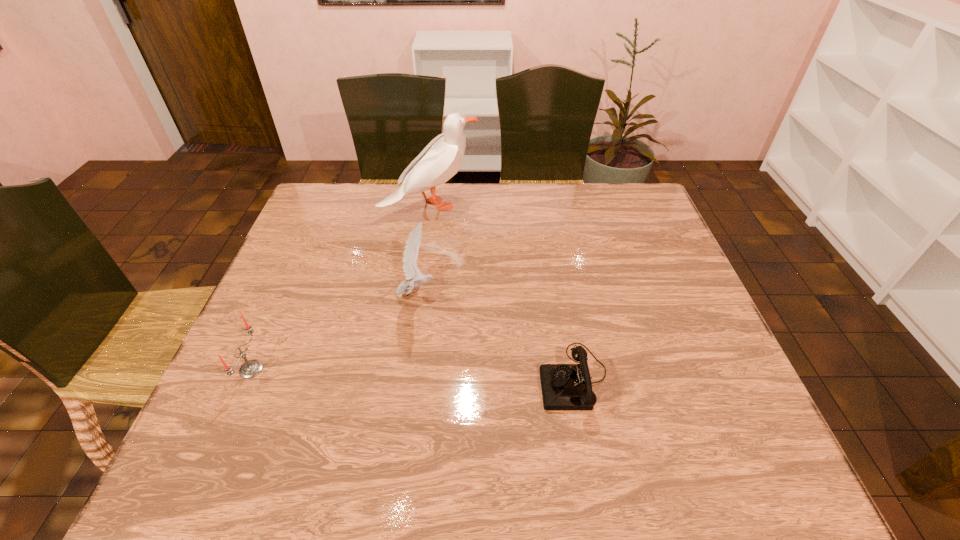
Where is `free region located on the front face of the shortest object`? The height and width of the screenshot is (540, 960). free region located on the front face of the shortest object is located at coordinates (359, 379).

Identify the location of vacant space located 0.280m on the front face of the shortest object. The height and width of the screenshot is (540, 960). click(413, 379).

Locate an element on the screen. free location located on the front face of the shortest object is located at coordinates (494, 379).

Locate an element on the screen. This screenshot has height=540, width=960. object situated at the far edge is located at coordinates (440, 160).

In order to click on object at the left edge in this screenshot , I will do (251, 368).

Locate an element on the screen. free space at the far edge is located at coordinates (561, 197).

The width and height of the screenshot is (960, 540). Identify the location of vacant space at the near edge of the desktop. (512, 482).

This screenshot has width=960, height=540. Find the location of `free region at the left edge`. free region at the left edge is located at coordinates (240, 343).

The image size is (960, 540). What are the coordinates of `vacant space at the far left corner of the desktop` in the screenshot? It's located at (319, 195).

Find the location of a particular element. The height and width of the screenshot is (540, 960). vacant space at the near left corner is located at coordinates (193, 440).